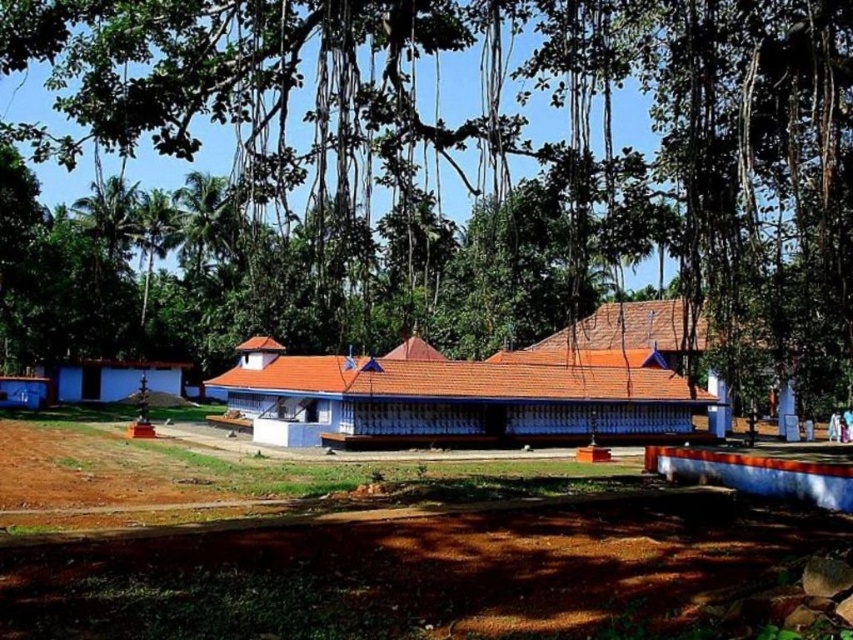
You are standing at the entrance of the temple complex and want to take a photo of the temple with the green leafy tree at upper center in the background. Based on the temple layout, will the tree be visible in the photo?

The green leafy tree at upper center is located at point [496,154], which places it in the background area of the temple complex. Since the tree is positioned at upper center, it should be visible in the photo taken from the entrance, framing the temple nicely against the tree backdrop.